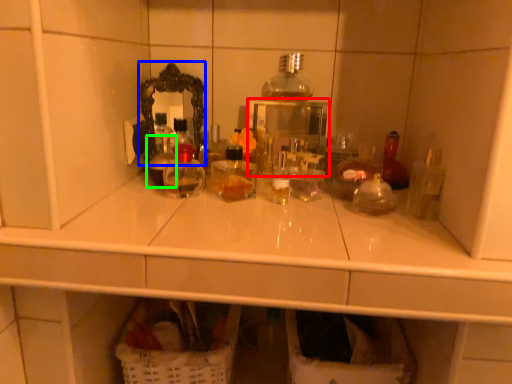
Question: Based on their relative distances, which object is farther from medicine cabinet (highlighted by a red box)? Choose from mirror (highlighted by a blue box) and bottle (highlighted by a green box).

Choices:
 (A) mirror
 (B) bottle

Answer: (B)